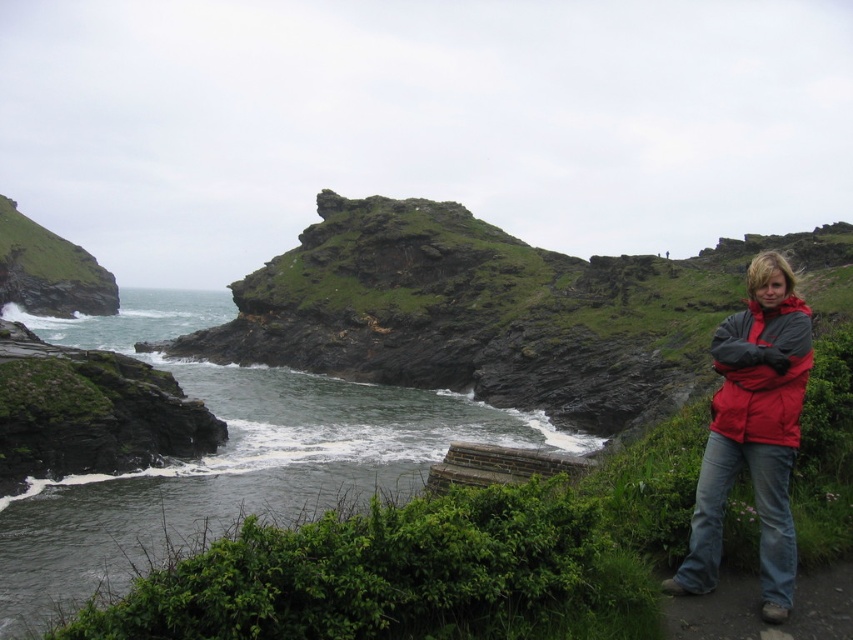
Based on the photo, you are standing at the edge of the cliff and want to walk to the brown dirt path at lower right. Which direction should you go relative to the green grassy hillside at left?

You should go to the right of the green grassy hillside at left to reach the brown dirt path at lower right.